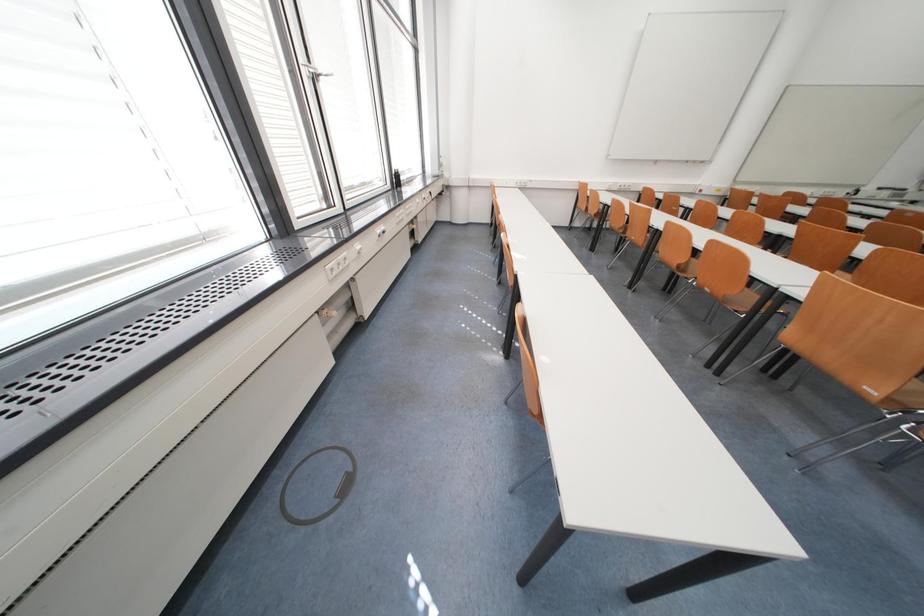
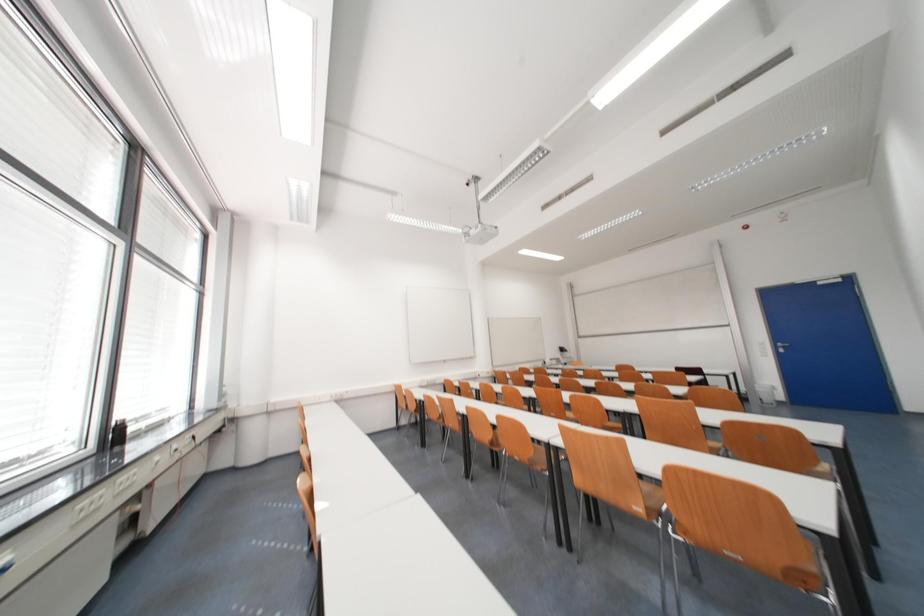
First-person continuous shooting, in which direction is the camera rotating?

The camera rotated toward right-up.